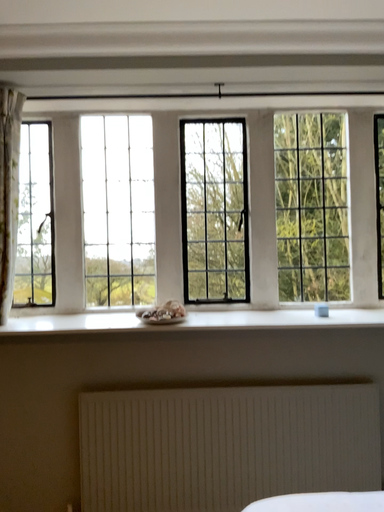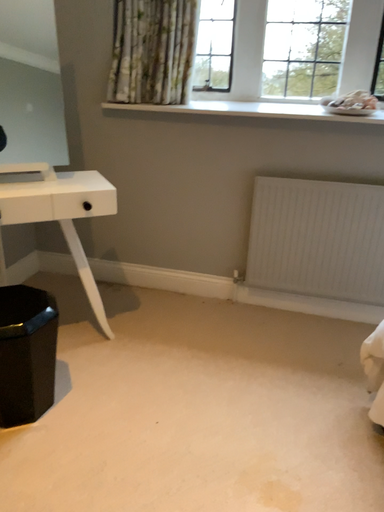
Question: Which way did the camera rotate in the video?

Choices:
 (A) rotated upward
 (B) rotated downward

Answer: (B)